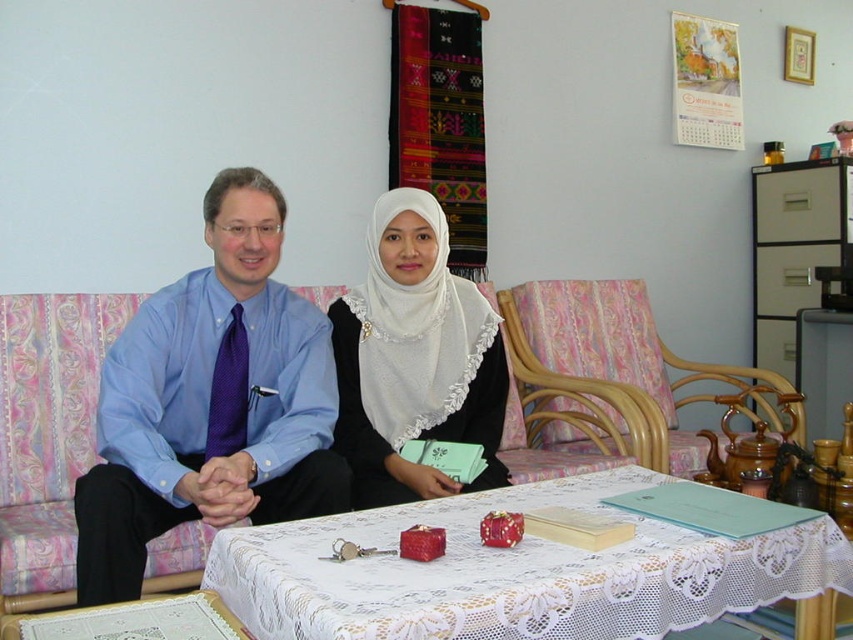
Between point (386, 214) and point (669, 467), which one is positioned behind?

The point (669, 467) is more distant.

Is white lace hijab at center wider than wooden armchair at center?

In fact, white lace hijab at center might be narrower than wooden armchair at center.

Is point (490, 454) behind point (566, 352)?

No, (490, 454) is closer to viewer.

The width and height of the screenshot is (853, 640). Find the location of `white lace hijab at center`. white lace hijab at center is located at coordinates (415, 358).

Which is below, blue satin shirt at center or white lace hijab at center?

blue satin shirt at center

Can you confirm if blue satin shirt at center is positioned below white lace hijab at center?

Correct, blue satin shirt at center is located below white lace hijab at center.

What do you see at coordinates (212, 401) in the screenshot? I see `blue satin shirt at center` at bounding box center [212, 401].

Where is `blue satin shirt at center`? This screenshot has width=853, height=640. blue satin shirt at center is located at coordinates (212, 401).

Which is more to the left, white lace tablecloth at center or blue fabric armchair at left?

Positioned to the left is blue fabric armchair at left.

Consider the image. Can you confirm if white lace tablecloth at center is positioned above blue fabric armchair at left?

Actually, white lace tablecloth at center is below blue fabric armchair at left.

Does point (627, 566) come in front of point (146, 579)?

Yes, it is.

Identify the location of white lace tablecloth at center. (514, 572).